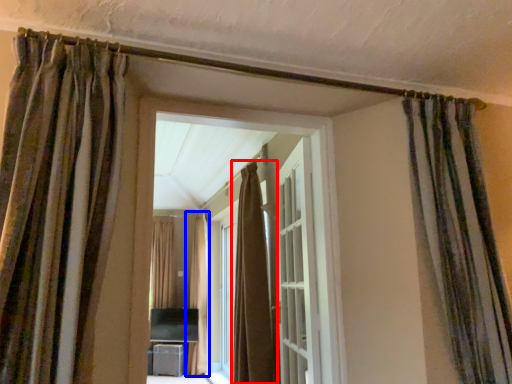
Question: Which object is closer to the camera taking this photo, curtain (highlighted by a red box) or curtain (highlighted by a blue box)?

Choices:
 (A) curtain
 (B) curtain

Answer: (A)